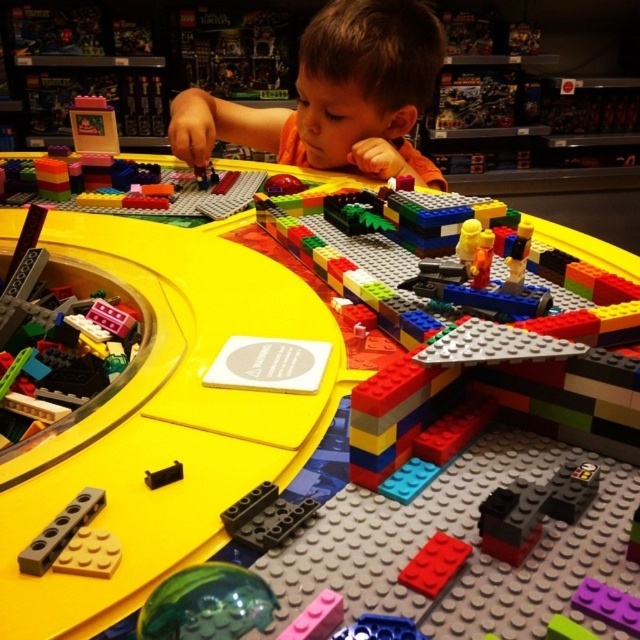
Who is higher up, brown hair at upper center or pink matte brick at center?

brown hair at upper center is higher up.

Who is positioned more to the left, brown hair at upper center or pink matte brick at center?

brown hair at upper center

Does point (400, 24) come in front of point (284, 636)?

No, (400, 24) is behind (284, 636).

Find the location of a particular element. brown hair at upper center is located at coordinates (336, 97).

Who is positioned more to the left, black matte brick at center or blue plastic bricks at lower center?

black matte brick at center

Can you confirm if black matte brick at center is thinner than blue plastic bricks at lower center?

No.

Is point (260, 552) positioned before point (397, 637)?

No.

Locate an element on the screen. black matte brick at center is located at coordinates (266, 516).

Does brown hair at upper center appear on the left side of red matte brick at lower center?

Yes, brown hair at upper center is to the left of red matte brick at lower center.

The height and width of the screenshot is (640, 640). Identify the location of brown hair at upper center. (336, 97).

Identify the location of brown hair at upper center. The height and width of the screenshot is (640, 640). coord(336,97).